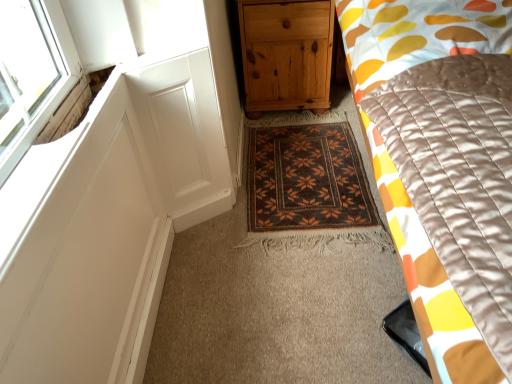
The image size is (512, 384). Find the location of `free point above brown woven mat at center (from a real-world perspective)`. free point above brown woven mat at center (from a real-world perspective) is located at coordinates pyautogui.click(x=284, y=177).